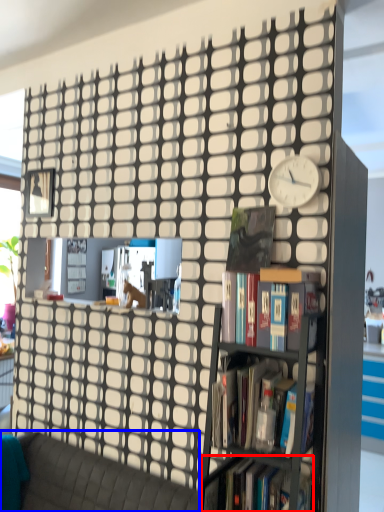
Question: Which of the following is the farthest to the observer, book (highlighted by a red box) or studio couch (highlighted by a blue box)?

Choices:
 (A) book
 (B) studio couch

Answer: (A)